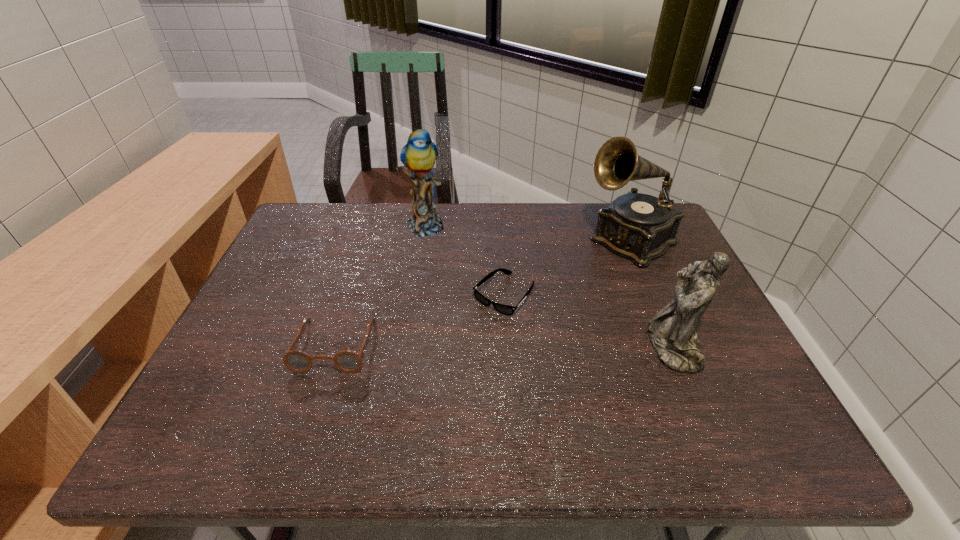
Locate an element on the screen. The width and height of the screenshot is (960, 540). phonograph record that is at the far edge is located at coordinates (640, 227).

At what (x,y) coordinates should I click in order to perform the action: click on parrot that is at the far edge. Please return your answer as a coordinate pair (x, y). Looking at the image, I should click on (419, 154).

The image size is (960, 540). I want to click on figurine present at the right edge, so click(x=671, y=333).

Where is `phonograph record situated at the right edge`? The height and width of the screenshot is (540, 960). phonograph record situated at the right edge is located at coordinates [640, 227].

At what (x,y) coordinates should I click in order to perform the action: click on object located in the far right corner section of the desktop. Please return your answer as a coordinate pair (x, y). This screenshot has height=540, width=960. Looking at the image, I should click on (640, 227).

In order to click on vacant space at the far edge in this screenshot , I will do `click(571, 234)`.

In the image, there is a desktop. At what (x,y) coordinates should I click in order to perform the action: click on vacant space at the left edge. Please return your answer as a coordinate pair (x, y). Looking at the image, I should click on (309, 249).

Locate an element on the screen. vacant space at the right edge of the desktop is located at coordinates tap(704, 333).

I want to click on free space at the far left corner, so click(x=340, y=226).

In order to click on vacant space at the near left corner of the desktop in this screenshot , I will do `click(238, 389)`.